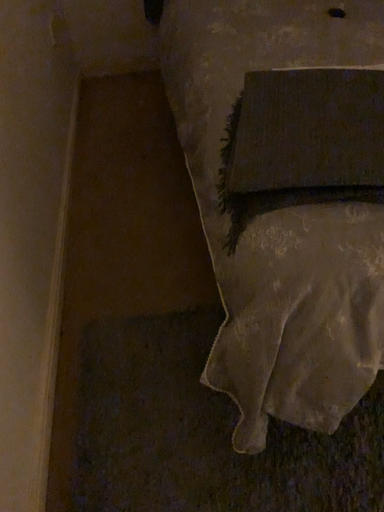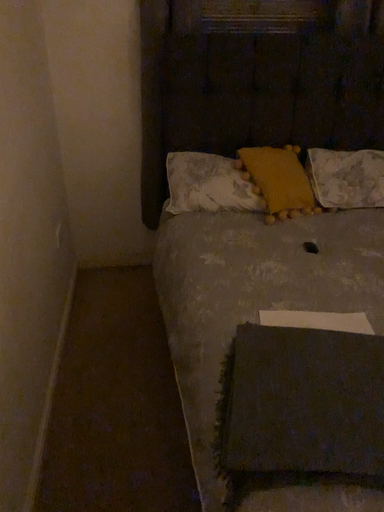
Question: Which way did the camera rotate in the video?

Choices:
 (A) rotated downward
 (B) rotated upward

Answer: (B)